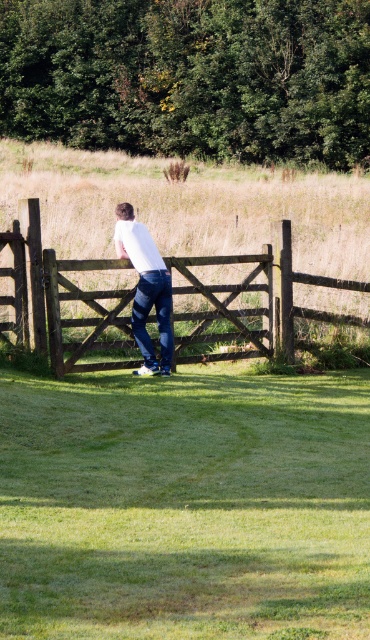
You are a delivery person trying to reach a mailbox located beyond the wooden gate at center. Your package is on the white matte shirt at center. Can you reach the mailbox without moving the package?

The distance between wooden gate at center and white matte shirt at center is 31.07 inches. Since the package is on the white matte shirt at center, you can reach the mailbox beyond the wooden gate at center without moving the package as the distance is manageable.

You are standing at the wooden gate in the rural scene. You notice two points marked on the ground. The first point is at coordinates point [298,312] and the second is at point [148,314]. If you want to place a small flowerpot between these two points, which point should you start from to ensure the flowerpot is closer to the viewer?

You should start from point [298,312] because it is closer to the viewer than point [148,314]. Placing the flowerpot between them starting from the closer point ensures it remains nearer to your position.